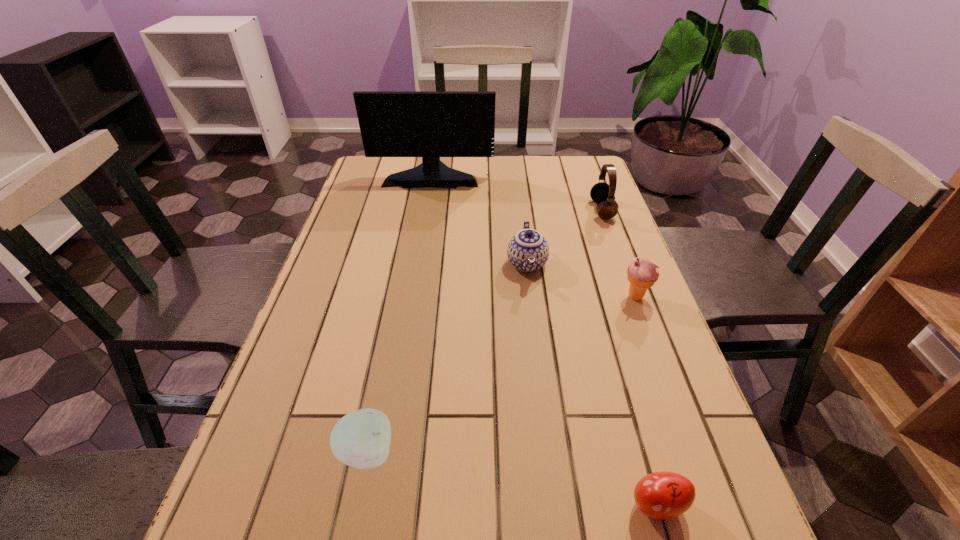
I want to click on vacant space that is in between the tallest object and the farther apple, so click(399, 314).

The image size is (960, 540). Identify the location of free spot between the monitor and the chinaware. [479, 219].

The image size is (960, 540). In order to click on vacant region between the nearer apple and the fifth nearest object in this screenshot , I will do `click(629, 357)`.

Identify the location of blank region between the third object from left to right and the icecream. (581, 280).

You are a GUI agent. You are given a task and a screenshot of the screen. Output one action in this format:
    pyautogui.click(x=<x>, y=<y>)
    Task: Click on the free space between the chinaware and the farther apple
    The width and height of the screenshot is (960, 540).
    Given the screenshot: What is the action you would take?
    pyautogui.click(x=446, y=358)

The image size is (960, 540). What are the coordinates of `free space that is in between the chinaware and the headset` in the screenshot? It's located at (564, 237).

In order to click on free space that is in between the tallest object and the second nearest object in this screenshot , I will do `click(399, 314)`.

Where is `free space between the nearer apple and the second farthest object`? free space between the nearer apple and the second farthest object is located at coordinates (629, 357).

Image resolution: width=960 pixels, height=540 pixels. I want to click on free space between the chinaware and the nearer apple, so click(591, 384).

Find the location of a particular element. Image resolution: width=960 pixels, height=540 pixels. the closest object relative to the farther apple is located at coordinates (662, 495).